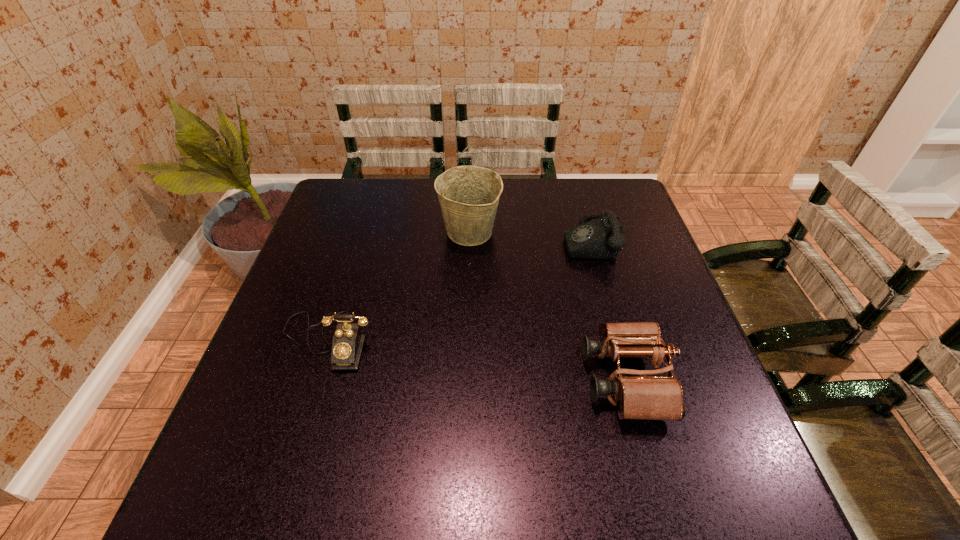
This screenshot has width=960, height=540. Identify the location of blank space located on the dial of the left telephone. (300, 429).

At what (x,y) coordinates should I click in order to perform the action: click on free space located on the dial of the farther telephone. Please return your answer as a coordinate pair (x, y). Looking at the image, I should click on (540, 241).

Where is `vacant area situated on the dial of the farther telephone`? This screenshot has width=960, height=540. vacant area situated on the dial of the farther telephone is located at coordinates (451, 241).

Identify the location of vacant space located 0.370m on the dial of the farther telephone. (434, 241).

This screenshot has height=540, width=960. Identify the location of wine bucket that is at the far edge. (469, 195).

Locate an element on the screen. The height and width of the screenshot is (540, 960). telephone present at the far edge is located at coordinates (601, 238).

Locate an element on the screen. This screenshot has height=540, width=960. object at the left edge is located at coordinates (347, 344).

Identify the location of binoculars present at the right edge. (640, 394).

Find the location of a particular element. telephone that is at the right edge is located at coordinates (601, 238).

Where is `object at the far right corner`? object at the far right corner is located at coordinates (601, 238).